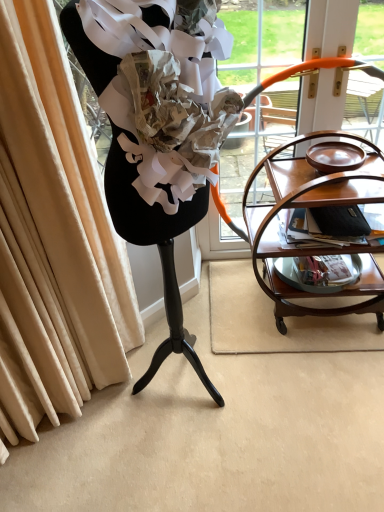
Question: Is the depth of wooden tea cart at right greater than that of matte brown magazine at right?

Choices:
 (A) no
 (B) yes

Answer: (A)

Question: Is wooden tea cart at right shorter than matte brown magazine at right?

Choices:
 (A) no
 (B) yes

Answer: (A)

Question: Can we say wooden tea cart at right lies outside matte brown magazine at right?

Choices:
 (A) no
 (B) yes

Answer: (B)

Question: Does wooden tea cart at right have a lesser width compared to matte brown magazine at right?

Choices:
 (A) no
 (B) yes

Answer: (A)

Question: Is wooden tea cart at right turned away from matte brown magazine at right?

Choices:
 (A) no
 (B) yes

Answer: (A)

Question: From the image's perspective, is wooden tea cart at right below matte brown magazine at right?

Choices:
 (A) no
 (B) yes

Answer: (B)

Question: Is matte brown magazine at right bigger than mahogany wood serving cart at right?

Choices:
 (A) yes
 (B) no

Answer: (B)

Question: Considering the relative sizes of matte brown magazine at right and mahogany wood serving cart at right in the image provided, is matte brown magazine at right smaller than mahogany wood serving cart at right?

Choices:
 (A) yes
 (B) no

Answer: (A)

Question: Is matte brown magazine at right at the left side of mahogany wood serving cart at right?

Choices:
 (A) yes
 (B) no

Answer: (A)

Question: Is matte brown magazine at right next to mahogany wood serving cart at right and touching it?

Choices:
 (A) no
 (B) yes

Answer: (A)

Question: From the image's perspective, is matte brown magazine at right beneath mahogany wood serving cart at right?

Choices:
 (A) no
 (B) yes

Answer: (A)

Question: Is mahogany wood serving cart at right inside matte brown magazine at right?

Choices:
 (A) yes
 (B) no

Answer: (B)

Question: Is matte brown magazine at right positioned beyond the bounds of wooden tea cart at right?

Choices:
 (A) no
 (B) yes

Answer: (B)